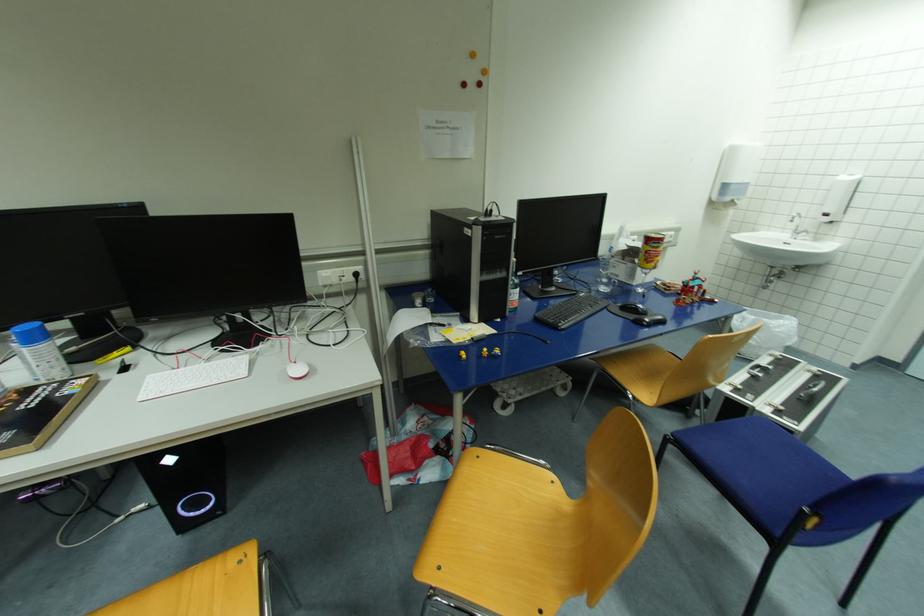
This screenshot has height=616, width=924. I want to click on sink faucet handle, so click(796, 225).